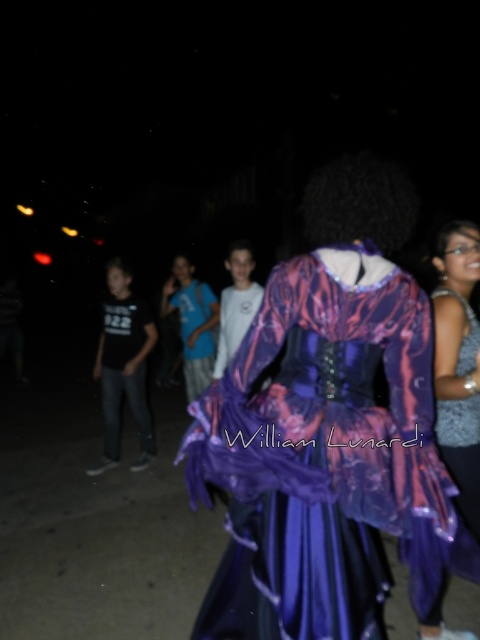
Between point (108, 332) and point (180, 337), which one is positioned behind?

Positioned behind is point (180, 337).

This screenshot has height=640, width=480. What do you see at coordinates (124, 369) in the screenshot?
I see `purple satin robe at left` at bounding box center [124, 369].

Identify the location of purple satin robe at left. This screenshot has height=640, width=480. (124, 369).

Measure the distance from shiny purple dress at center to purple satin robe at left.

9.07 feet

Which is above, shiny purple dress at center or purple satin robe at left?

purple satin robe at left

Between point (271, 566) and point (111, 348), which one is positioned in front?

Point (271, 566) is in front.

Locate an element on the screen. Image resolution: width=480 pixels, height=640 pixels. shiny purple dress at center is located at coordinates (324, 454).

Based on the photo, who is more distant from viewer, (365, 403) or (202, 372)?

The point (202, 372) is behind.

Does shiny purple dress at center come in front of purple satin robe at center?

Yes, it is in front of purple satin robe at center.

Who is more distant from viewer, (337, 305) or (213, 360)?

The point (213, 360) is behind.

Find the location of `shiny purple dress at center`. shiny purple dress at center is located at coordinates (324, 454).